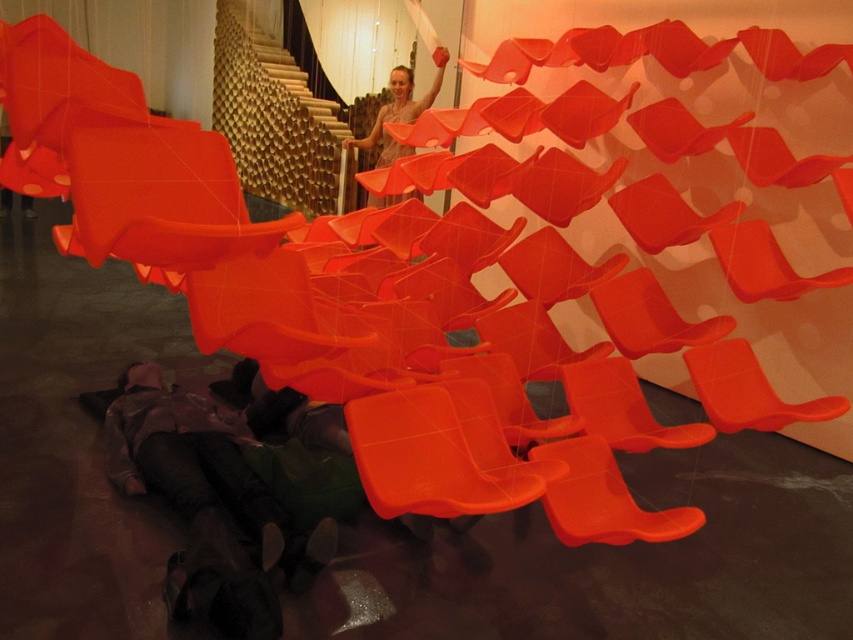
Which of these two, dark brown leather boots at lower left or matte plastic chair at center, stands taller?

With more height is dark brown leather boots at lower left.

Who is positioned more to the right, dark brown leather boots at lower left or matte plastic chair at center?

From the viewer's perspective, matte plastic chair at center appears more on the right side.

Measure the distance between point (157, 477) and camera.

Point (157, 477) and camera are 8.33 feet apart from each other.

This screenshot has height=640, width=853. I want to click on dark brown leather boots at lower left, so click(202, 476).

Is point (709, 396) behind point (392, 88)?

No.

Where is `matte plastic chair at center`? matte plastic chair at center is located at coordinates (747, 390).

What are the coordinates of `matte plastic chair at center` in the screenshot? It's located at (747, 390).

Measure the distance between point (268, 570) and camera.

A distance of 2.12 meters exists between point (268, 570) and camera.

Can you confirm if dark brown leather boots at lower left is positioned above matte orange fabric at upper center?

Incorrect, dark brown leather boots at lower left is not positioned above matte orange fabric at upper center.

Where is `dark brown leather boots at lower left`? This screenshot has width=853, height=640. dark brown leather boots at lower left is located at coordinates (202, 476).